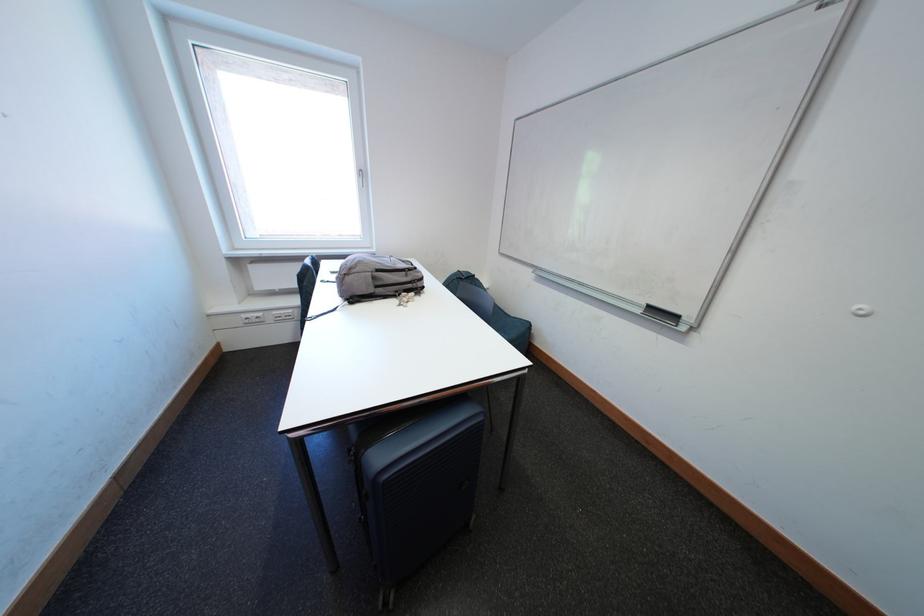
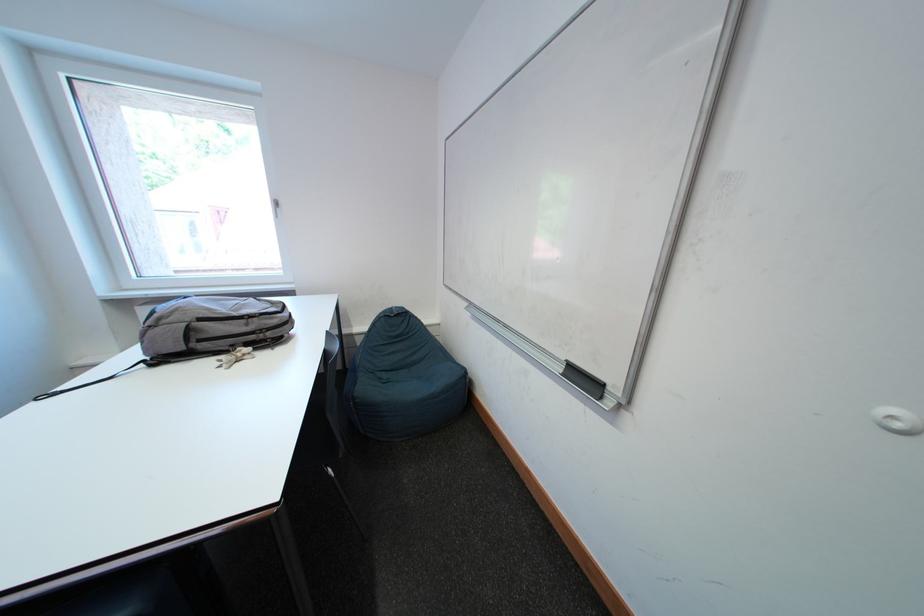
Where in the second image is the point corresponding to point 873,315 from the first image?

(906, 429)